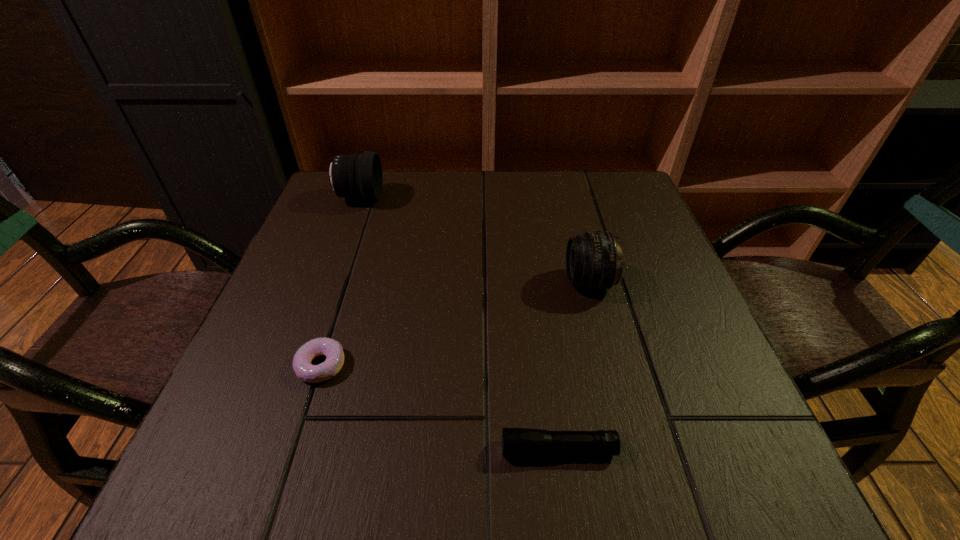
The image size is (960, 540). I want to click on the farther telephoto lens, so click(360, 176).

Where is `the left telephoto lens`? the left telephoto lens is located at coordinates (360, 176).

I want to click on the second farthest object, so click(594, 260).

This screenshot has height=540, width=960. In order to click on the right telephoto lens in this screenshot , I will do [594, 260].

In order to click on the nearest object in this screenshot , I will do `click(516, 442)`.

At what (x,y) coordinates should I click in order to perform the action: click on the third tallest object. Please return your answer as a coordinate pair (x, y). The image size is (960, 540). Looking at the image, I should click on (516, 442).

Find the location of a particular element. This screenshot has height=540, width=960. the shortest object is located at coordinates (332, 349).

Locate an element on the screen. This screenshot has height=540, width=960. doughnut is located at coordinates (332, 349).

You are a GUI agent. You are given a task and a screenshot of the screen. Output one action in this format:
    pyautogui.click(x=<x>, y=<y>)
    Task: Click on the free space located at the front element of the farthest object
    The height and width of the screenshot is (540, 960).
    Given the screenshot: What is the action you would take?
    pyautogui.click(x=460, y=197)

Find the location of a particular element. The width and height of the screenshot is (960, 540). free space located 0.350m at the front element of the right telephoto lens is located at coordinates (395, 282).